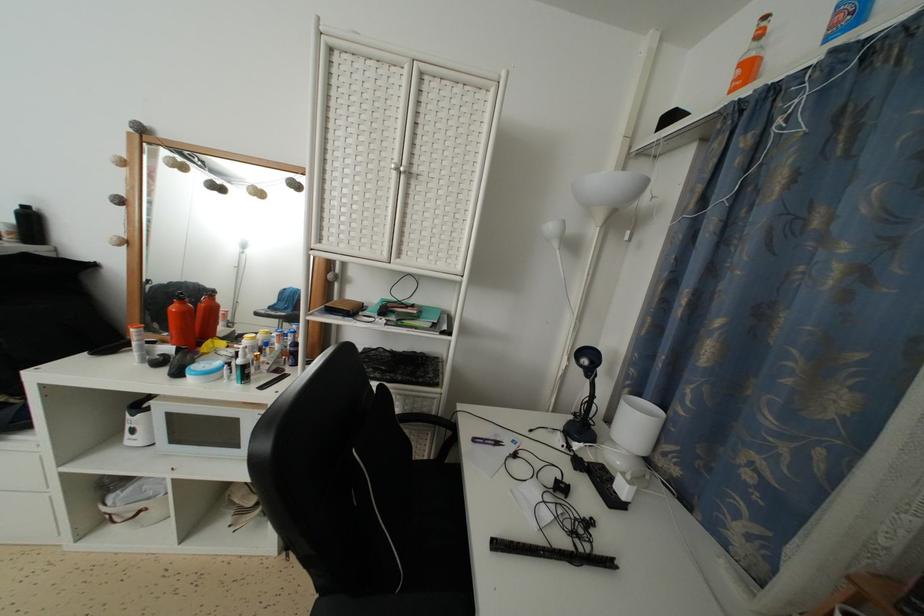
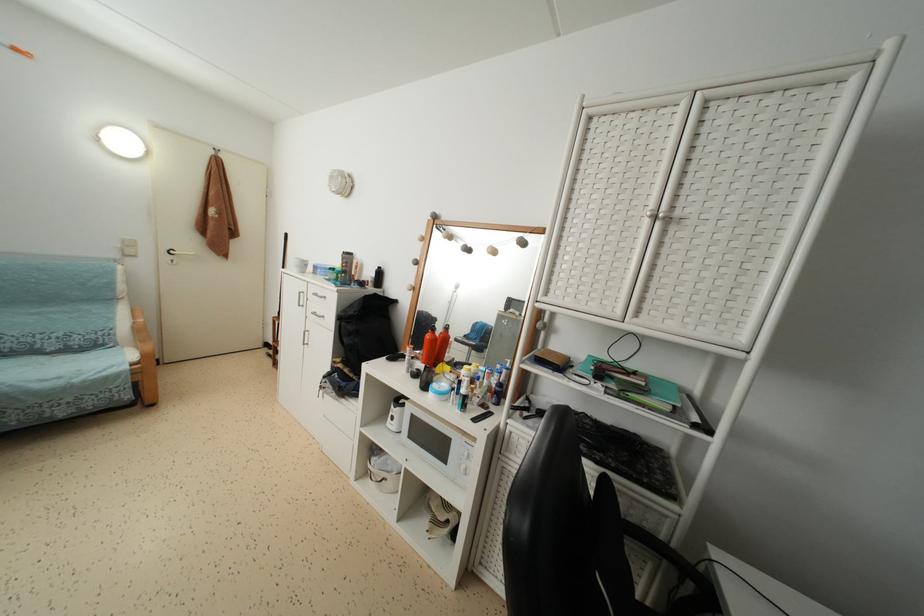
Question: Based on the continuous images, in which direction is the camera rotating? Reply with the corresponding letter.

Choices:
 (A) Left
 (B) Right
 (C) Up
 (D) Down

Answer: (A)